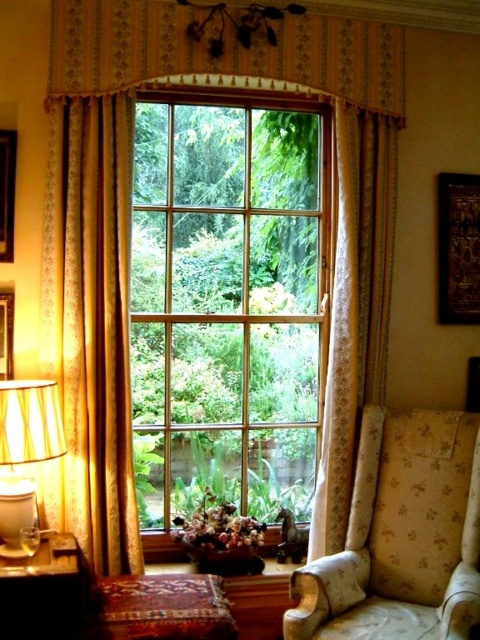
Question: Can you confirm if floral fabric armchair at lower right is positioned to the left of matte yellow lampshade at left?

Choices:
 (A) no
 (B) yes

Answer: (A)

Question: Which object is positioned closest to the wooden carved picture frame at upper right?

Choices:
 (A) floral fabric armchair at lower right
 (B) gold textured curtain at center
 (C) clear glass window at center

Answer: (B)

Question: Which of the following is the farthest from the observer?

Choices:
 (A) wooden picture frame at left
 (B) matte yellow lampshade at left

Answer: (A)

Question: Does floral fabric armchair at lower right lie behind wooden carved picture frame at upper right?

Choices:
 (A) no
 (B) yes

Answer: (A)

Question: Among these objects, which one is farthest from the camera?

Choices:
 (A) matte yellow lampshade at left
 (B) gold textured curtain at center
 (C) floral fabric armchair at lower right
 (D) matte black picture frame at left

Answer: (D)

Question: Is clear glass window at center above matte yellow lampshade at left?

Choices:
 (A) no
 (B) yes

Answer: (B)